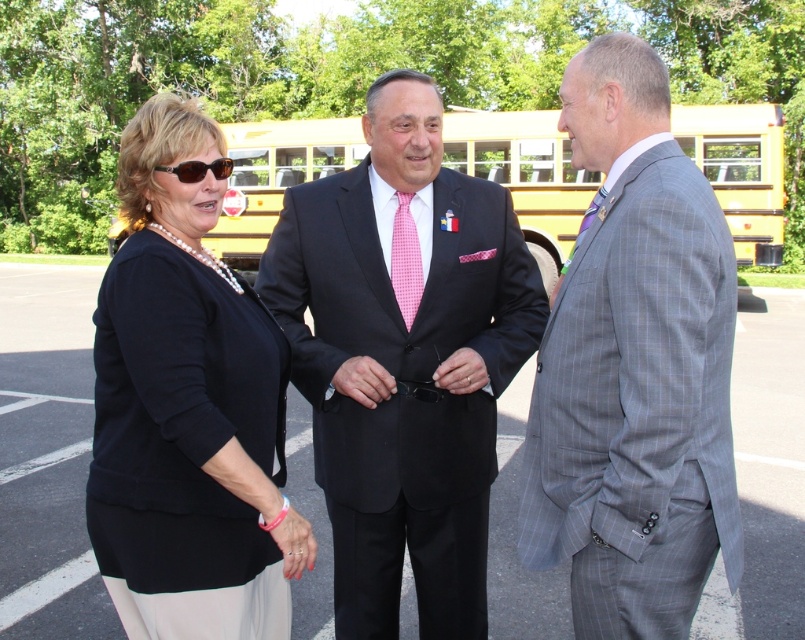
You are a photographer trying to capture a group photo of the gray checkered suit at right and the black matte cardigan at left. Which person should you position closer to the camera to ensure both appear equally tall in the photo?

The gray checkered suit at right is much taller than the black matte cardigan at left. To make them appear equally tall in the photo, position the black matte cardigan at left closer to the camera than the gray checkered suit at right.